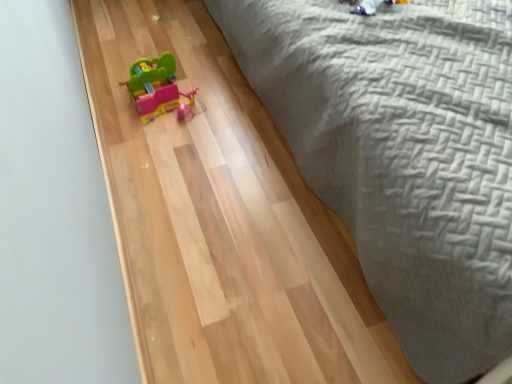
At what (x,y) coordinates should I click in order to perform the action: click on free space in front of matte plastic toy car at center. Please return your answer as a coordinate pair (x, y). Looking at the image, I should click on (165, 148).